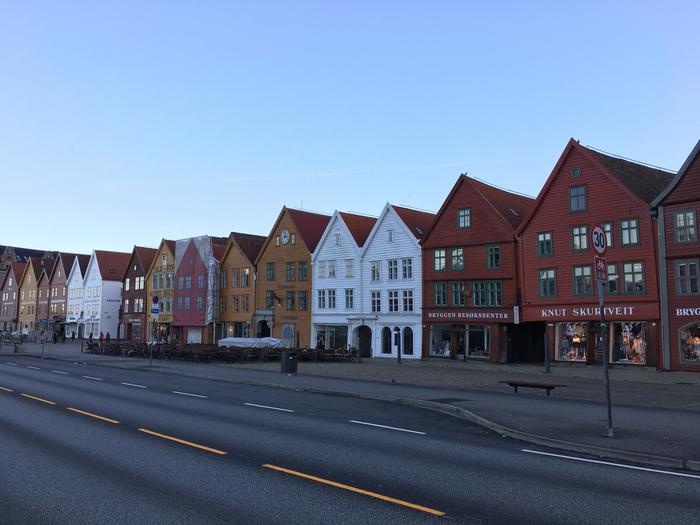
Identify the location of trash can in middle of photo. (288, 360).